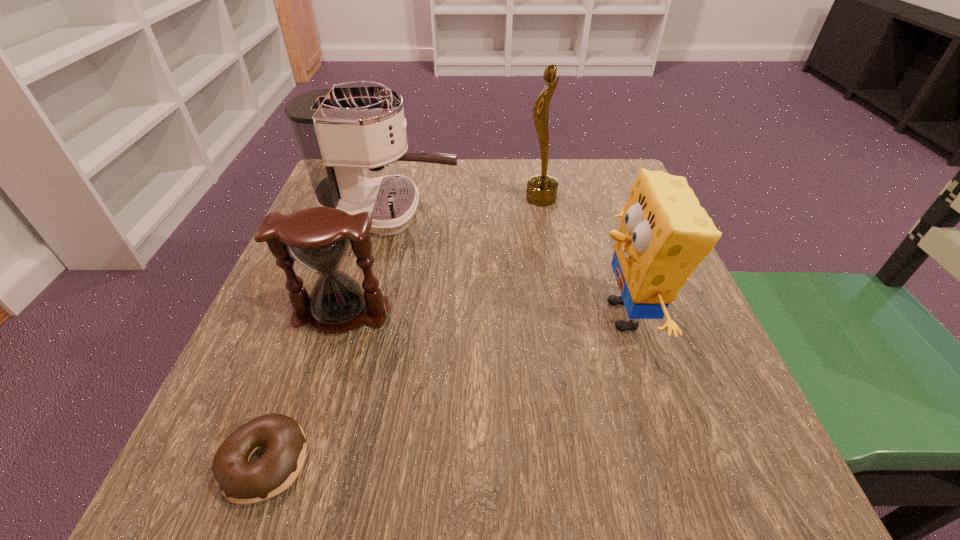
In order to click on doughnut at the left edge in this screenshot , I will do `click(241, 482)`.

Image resolution: width=960 pixels, height=540 pixels. I want to click on object located in the right edge section of the desktop, so click(x=664, y=234).

I want to click on object that is at the far left corner, so click(339, 131).

At what (x,y) coordinates should I click in order to perform the action: click on object that is positioned at the near left corner. Please return your answer as a coordinate pair (x, y). The height and width of the screenshot is (540, 960). Looking at the image, I should click on click(x=241, y=482).

At what (x,y) coordinates should I click in order to perform the action: click on vacant region at the far edge of the desktop. Please return your answer as a coordinate pair (x, y). The height and width of the screenshot is (540, 960). Looking at the image, I should click on pyautogui.click(x=440, y=181).

I want to click on vacant space at the near edge of the desktop, so click(360, 507).

The height and width of the screenshot is (540, 960). Find the location of `vacant space at the left edge`. vacant space at the left edge is located at coordinates (309, 327).

In the image, there is a desktop. Identify the location of vacant space at the right edge. (674, 370).

The width and height of the screenshot is (960, 540). In order to click on vacant space at the far right corner of the desktop in this screenshot , I will do `click(594, 196)`.

The height and width of the screenshot is (540, 960). What are the coordinates of `free space between the coffee maker and the rightmost object` in the screenshot? It's located at point(507,264).